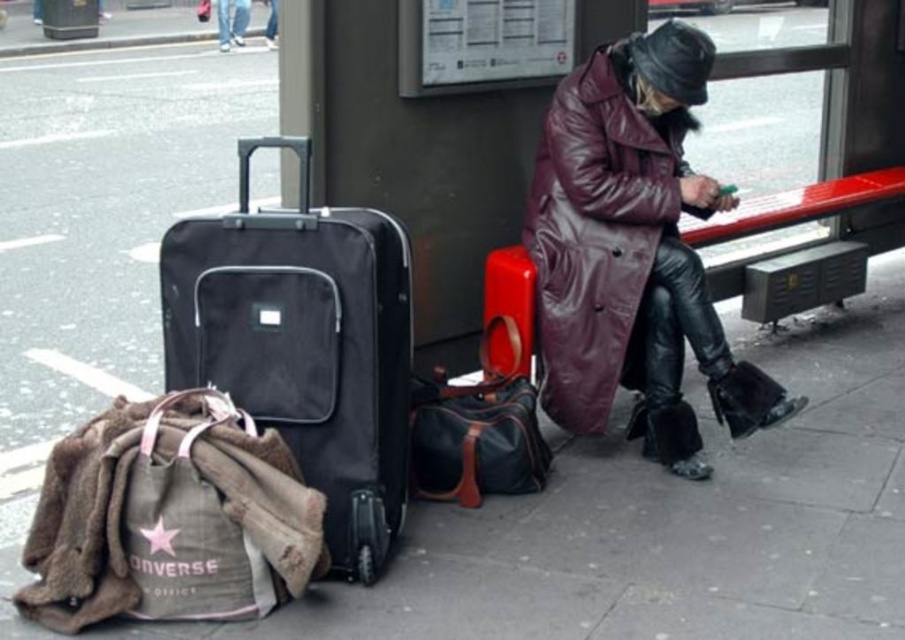
Where is `black fabric suitcase at lower left`? black fabric suitcase at lower left is located at coordinates (303, 344).

Measure the distance between point (x=296, y=376) and camera.

Point (x=296, y=376) is 2.61 meters away from camera.

The width and height of the screenshot is (905, 640). Identify the location of black fabric suitcase at lower left. (303, 344).

At what (x,y) coordinates should I click in order to perform the action: click on black fabric suitcase at lower left. Please return your answer as a coordinate pair (x, y). The height and width of the screenshot is (640, 905). Looking at the image, I should click on (303, 344).

Who is higher up, canvas converse bag at lower left or rubberized red suitcase at center?

rubberized red suitcase at center is higher up.

Which is behind, point (41, 560) or point (532, 326)?

Positioned behind is point (532, 326).

Is point (44, 618) farther from viewer compared to point (498, 368)?

No, (44, 618) is in front of (498, 368).

Where is `canvas converse bag at lower left`? The height and width of the screenshot is (640, 905). canvas converse bag at lower left is located at coordinates (169, 513).

Is black fabric suitcase at lower left positioned in front of leather duffel bag at center?

Yes, black fabric suitcase at lower left is in front of leather duffel bag at center.

Can you confirm if black fabric suitcase at lower left is wider than leather duffel bag at center?

Yes, black fabric suitcase at lower left is wider than leather duffel bag at center.

The width and height of the screenshot is (905, 640). Identify the location of black fabric suitcase at lower left. (303, 344).

You are a GUI agent. You are given a task and a screenshot of the screen. Output one action in this format:
    pyautogui.click(x=<x>, y=<y>)
    Task: Click on the black fabric suitcase at lower left
    Image resolution: width=905 pixels, height=640 pixels.
    Given the screenshot: What is the action you would take?
    pyautogui.click(x=303, y=344)